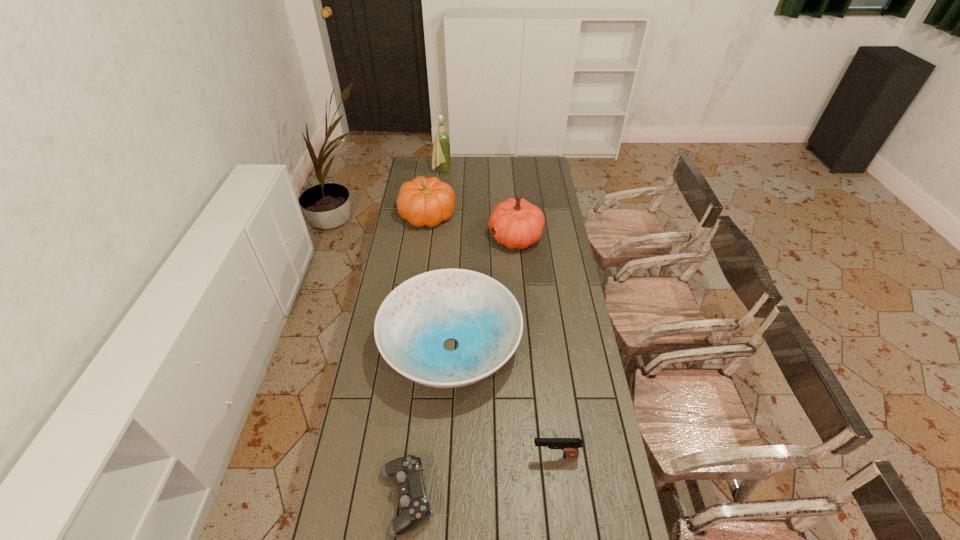
Find the location of a particular element. The height and width of the screenshot is (540, 960). dish present at the left edge is located at coordinates (413, 322).

This screenshot has width=960, height=540. What are the coordinates of `pumpkin at the right edge` in the screenshot? It's located at (517, 223).

At what (x,y) coordinates should I click in order to perform the action: click on pistol positioned at the right edge. Please return your answer as a coordinate pair (x, y). This screenshot has width=960, height=540. Looking at the image, I should click on (570, 446).

The width and height of the screenshot is (960, 540). I want to click on object that is at the far left corner, so click(441, 150).

Where is `vacant space at the left edge of the desktop`? vacant space at the left edge of the desktop is located at coordinates (398, 239).

This screenshot has width=960, height=540. What are the coordinates of `vacant region at the right edge of the desktop` in the screenshot? It's located at (535, 195).

Identify the location of free space at the far right corner of the desktop. This screenshot has width=960, height=540. (540, 175).

Locate which object ranks second in proximity to the wine bottle. Please provide its 2D coordinates. Your answer should be formatted as a tuple, i.e. [(x, y)], where the tuple contains the x and y coordinates of a point satisfying the conditions above.

[(517, 223)]

Identify which object is the fifth nearest to the right pumpkin. Please provide its 2D coordinates. Your answer should be formatted as a tuple, i.e. [(x, y)], where the tuple contains the x and y coordinates of a point satisfying the conditions above.

[(407, 471)]

You are a GUI agent. You are given a task and a screenshot of the screen. Output one action in this format:
    pyautogui.click(x=<x>, y=<y>)
    Task: Click on the blank area in the image that satisfies the following two spatial constraints: 1. on the front-facing side of the right pumpkin; 2. on the front side of the fourth tallest object
    
    Given the screenshot: What is the action you would take?
    pyautogui.click(x=525, y=346)